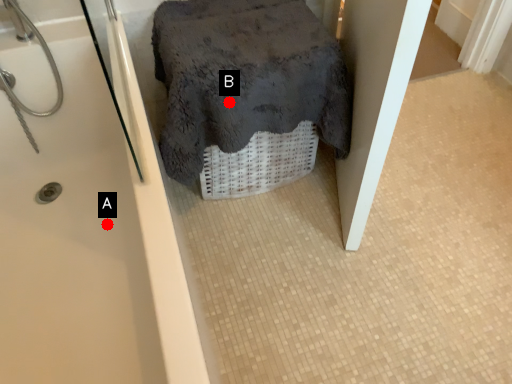
Question: Two points are circled on the image, labeled by A and B beside each circle. Which point appears farthest from the camera in this image?

Choices:
 (A) A is further
 (B) B is further

Answer: (A)